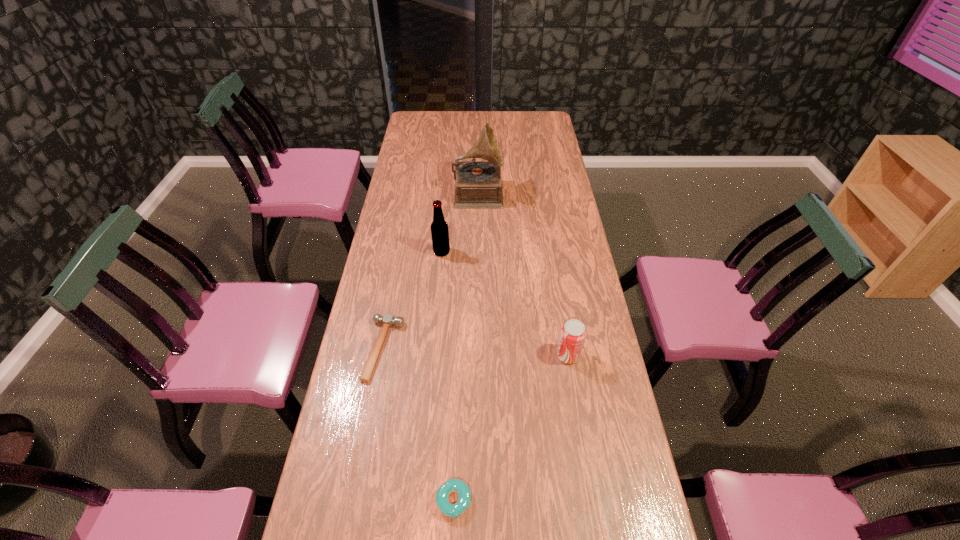
Image resolution: width=960 pixels, height=540 pixels. What are the coordinates of `vacant space at the far left corner of the desktop` in the screenshot? It's located at (411, 119).

Image resolution: width=960 pixels, height=540 pixels. Identify the location of free spot between the rightmost object and the fourth nearest object. (505, 303).

Find the location of a particular element. Image resolution: width=960 pixels, height=540 pixels. free point between the doughnut and the hammer is located at coordinates (419, 424).

Image resolution: width=960 pixels, height=540 pixels. Find the location of `vacant area between the third shortest object and the nearest object`. vacant area between the third shortest object and the nearest object is located at coordinates (511, 428).

Image resolution: width=960 pixels, height=540 pixels. I want to click on vacant area between the rightmost object and the nearest object, so click(511, 428).

Image resolution: width=960 pixels, height=540 pixels. I want to click on free space that is in between the second tallest object and the rightmost object, so click(x=505, y=303).

Find the location of `free space between the leftmost object and the second farthest object`. free space between the leftmost object and the second farthest object is located at coordinates (413, 300).

Locate an element on the screen. The width and height of the screenshot is (960, 540). free space between the beer bottle and the rightmost object is located at coordinates (505, 303).

What are the coordinates of `empty space that is in between the third tallest object and the tallest object` in the screenshot? It's located at (523, 273).

Where is `empty space that is in between the leftmost object and the beer bottle`? The image size is (960, 540). empty space that is in between the leftmost object and the beer bottle is located at coordinates (413, 300).